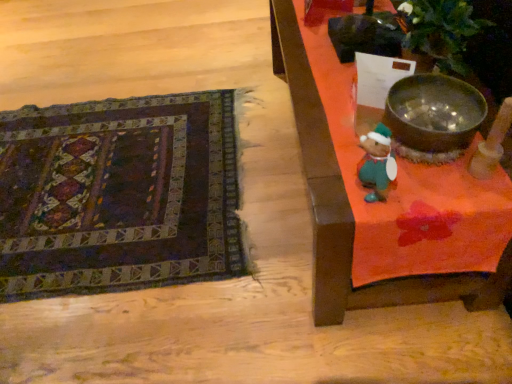
The height and width of the screenshot is (384, 512). What do you see at coordinates (434, 113) in the screenshot?
I see `shiny metallic bowl at upper right` at bounding box center [434, 113].

Locate an element on the screen. This screenshot has height=384, width=512. dark woven rug at lower left is located at coordinates (119, 195).

Who is taller, wooden table at right or dark woven rug at lower left?

Standing taller between the two is wooden table at right.

Measure the distance between wooden table at right and dark woven rug at lower left.

A distance of 26.55 inches exists between wooden table at right and dark woven rug at lower left.

The image size is (512, 384). I want to click on mat behind the wooden table at right, so click(119, 195).

Is shiny metallic bowl at upper right placed right next to wooden table at right?

shiny metallic bowl at upper right and wooden table at right are clearly separated.

Is shiny metallic bowl at upper right located outside wooden table at right?

Indeed, shiny metallic bowl at upper right is completely outside wooden table at right.

Can you tell me how much shiny metallic bowl at upper right and wooden table at right differ in facing direction?

The angle between the facing direction of shiny metallic bowl at upper right and the facing direction of wooden table at right is 1.05 degrees.

Is shiny metallic bowl at upper right behind wooden table at right?

Yes, shiny metallic bowl at upper right is further from the camera.

Is point (121, 270) farther from viewer compared to point (425, 74)?

Yes, point (121, 270) is farther from viewer.

From a real-world perspective, who is located lower, dark woven rug at lower left or shiny metallic bowl at upper right?

From a 3D spatial view, dark woven rug at lower left is below.

In terms of size, does dark woven rug at lower left appear bigger or smaller than shiny metallic bowl at upper right?

Clearly, dark woven rug at lower left is larger in size than shiny metallic bowl at upper right.

In the scene shown: Is dark woven rug at lower left oriented away from shiny metallic bowl at upper right?

No, shiny metallic bowl at upper right is not at the back of dark woven rug at lower left.

From the image's perspective, which is above, shiny metallic bowl at upper right or dark woven rug at lower left?

shiny metallic bowl at upper right appears higher in the image.

Is shiny metallic bowl at upper right oriented away from dark woven rug at lower left?

No, shiny metallic bowl at upper right's orientation is not away from dark woven rug at lower left.

Considering their positions, is shiny metallic bowl at upper right located in front of or behind dark woven rug at lower left?

shiny metallic bowl at upper right is positioned closer to the viewer than dark woven rug at lower left.

Considering the positions of points (479, 118) and (220, 136), is point (479, 118) farther from camera compared to point (220, 136)?

No, (479, 118) is in front of (220, 136).

Which point is more distant from viewer, (331, 240) or (394, 114)?

The point (394, 114) is farther.

Can you tell me how much wooden table at right and shiny metallic bowl at upper right differ in facing direction?

1.05 degrees.

This screenshot has height=384, width=512. In order to click on furniture in front of the shiny metallic bowl at upper right in this screenshot , I will do `click(350, 205)`.

Which is behind, wooden table at right or shiny metallic bowl at upper right?

shiny metallic bowl at upper right is further from the camera.

In the image, there is a wooden table at right. Where is `mat below it (from the image's perspective)`? mat below it (from the image's perspective) is located at coordinates (119, 195).

Is dark woven rug at lower left inside the boundaries of wooden table at right, or outside?

dark woven rug at lower left is outside wooden table at right.

Is dark woven rug at lower left to the right of wooden table at right from the viewer's perspective?

No.

Would you consider dark woven rug at lower left to be distant from wooden table at right?

That's not correct — dark woven rug at lower left is a little close to wooden table at right.

Locate an element on the screen. The height and width of the screenshot is (384, 512). furniture on the right side of dark woven rug at lower left is located at coordinates (350, 205).

Where is `mixing bowl below the wooden table at right (from the image's perspective)`? mixing bowl below the wooden table at right (from the image's perspective) is located at coordinates 434,113.

From the image, which object appears to be nearer to wooden table at right, shiny metallic bowl at upper right or dark woven rug at lower left?

shiny metallic bowl at upper right lies closer to wooden table at right than the other object.

When comparing their distances from shiny metallic bowl at upper right, does wooden table at right or dark woven rug at lower left seem closer?

wooden table at right is positioned closer to the anchor shiny metallic bowl at upper right.

Based on their spatial positions, is dark woven rug at lower left or wooden table at right further from shiny metallic bowl at upper right?

Among the two, dark woven rug at lower left is located further to shiny metallic bowl at upper right.

Which object lies further to the anchor point wooden table at right, dark woven rug at lower left or shiny metallic bowl at upper right?

The object further to wooden table at right is dark woven rug at lower left.

When comparing their distances from dark woven rug at lower left, does wooden table at right or shiny metallic bowl at upper right seem further?

shiny metallic bowl at upper right is positioned further to the anchor dark woven rug at lower left.

Based on their spatial positions, is shiny metallic bowl at upper right or wooden table at right further from dark woven rug at lower left?

shiny metallic bowl at upper right.

I want to click on furniture between dark woven rug at lower left and shiny metallic bowl at upper right from left to right, so click(350, 205).